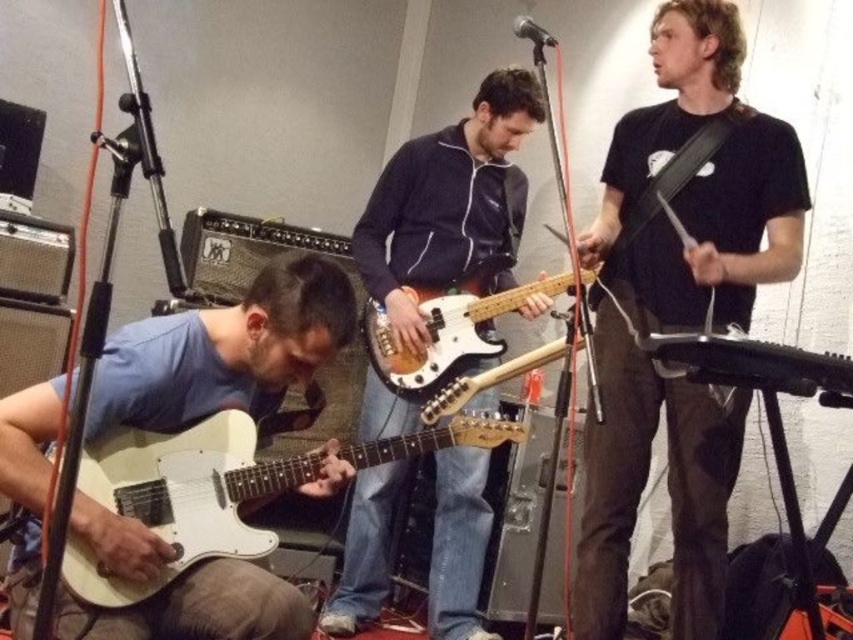
Question: Which object is the farthest from the wooden electric bass at center?

Choices:
 (A) white matte guitar at lower left
 (B) black matte guitar at center
 (C) white matte electric guitar at lower left

Answer: (A)

Question: Observing the image, what is the correct spatial positioning of black matte guitar at center in reference to wooden electric bass at center?

Choices:
 (A) right
 (B) left

Answer: (A)

Question: Does white matte guitar at lower left appear on the left side of white matte electric guitar at lower left?

Choices:
 (A) yes
 (B) no

Answer: (A)

Question: Which point appears farthest from the camera in this image?

Choices:
 (A) (451, 262)
 (B) (479, 340)
 (C) (482, 428)
 (D) (238, 390)

Answer: (A)

Question: Among these points, which one is nearest to the camera?

Choices:
 (A) (173, 493)
 (B) (422, 360)
 (C) (28, 616)

Answer: (C)

Question: Is white matte guitar at lower left to the right of white matte electric guitar at lower left from the viewer's perspective?

Choices:
 (A) yes
 (B) no

Answer: (B)